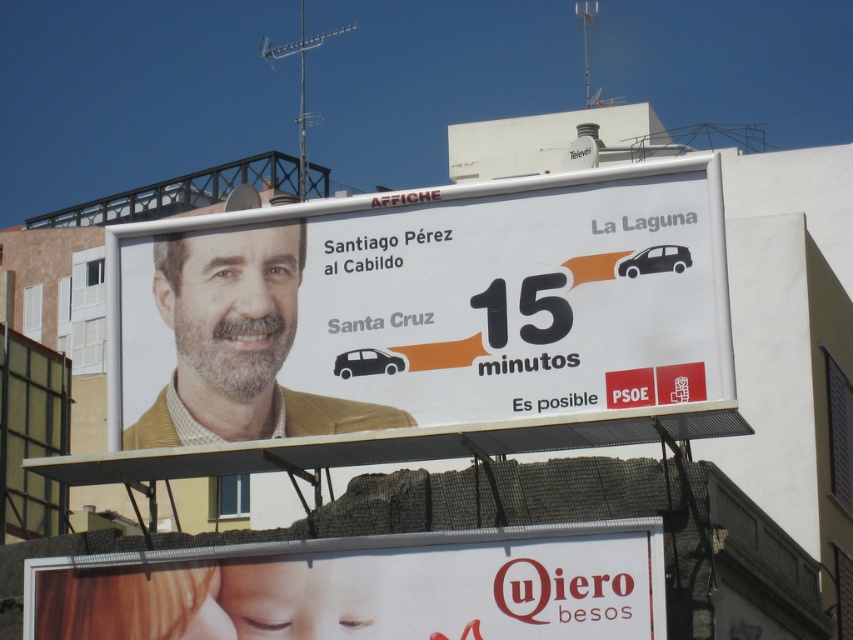
You are a pedestrian standing in front of the billboard. You notice the white paper billboard at center and the matte yellow jacket at center. Which object is positioned to the left?

The matte yellow jacket at center is positioned to the left of the white paper billboard at center.

What is the spatial relationship between the white paper at lower center and the matte yellow jacket at center in terms of height?

The white paper at lower center has a greater height compared to the matte yellow jacket at center.

Consider the image. You are standing in front of the billboard and want to touch both the white paper billboard at center and the matte yellow jacket at center. Which object will you need to reach further to touch?

The matte yellow jacket at center is further away from you than the white paper billboard at center, so you will need to reach further to touch the matte yellow jacket at center.